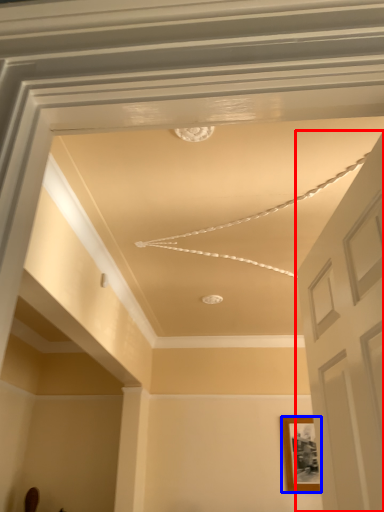
Question: Which object is closer to the camera taking this photo, door (highlighted by a red box) or picture frame (highlighted by a blue box)?

Choices:
 (A) door
 (B) picture frame

Answer: (A)